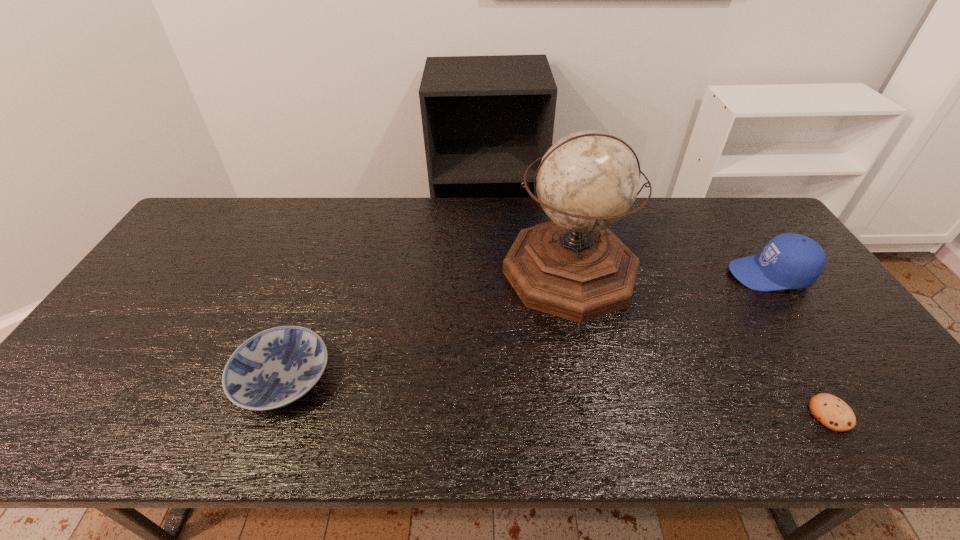
You are a GUI agent. You are given a task and a screenshot of the screen. Output one action in this format:
    pyautogui.click(x=<x>, y=<y>)
    Task: Click on the free space between the shortest object and the globe
    
    Given the screenshot: What is the action you would take?
    pyautogui.click(x=700, y=343)

This screenshot has width=960, height=540. What are the coordinates of `vacant region between the cap and the tallest object` in the screenshot? It's located at (669, 273).

Find the location of a particular element. free space between the second object from left to right and the plate is located at coordinates (426, 325).

At what (x,y) coordinates should I click in order to perform the action: click on vacant point located between the globe and the shortest object. Please return your answer as a coordinate pair (x, y). Looking at the image, I should click on (700, 343).

Choose which object is the second nearest neighbor to the third shortest object. Please provide its 2D coordinates. Your answer should be formatted as a tuple, i.e. [(x, y)], where the tuple contains the x and y coordinates of a point satisfying the conditions above.

[(832, 412)]

This screenshot has width=960, height=540. In order to click on the third closest object relative to the cap in this screenshot , I will do `click(274, 368)`.

At what (x,y) coordinates should I click in order to perform the action: click on free space that satisfies the following two spatial constraints: 1. on the surface of the globe; 2. on the left side of the shortest object. Please return your answer as a coordinate pair (x, y). Looking at the image, I should click on (600, 414).

The height and width of the screenshot is (540, 960). Identify the location of free location that satisfies the following two spatial constraints: 1. on the front-facing side of the third shortest object; 2. on the front side of the third tallest object. (840, 379).

I want to click on vacant space that satisfies the following two spatial constraints: 1. on the front-facing side of the second tallest object; 2. on the front side of the cookie, so click(864, 414).